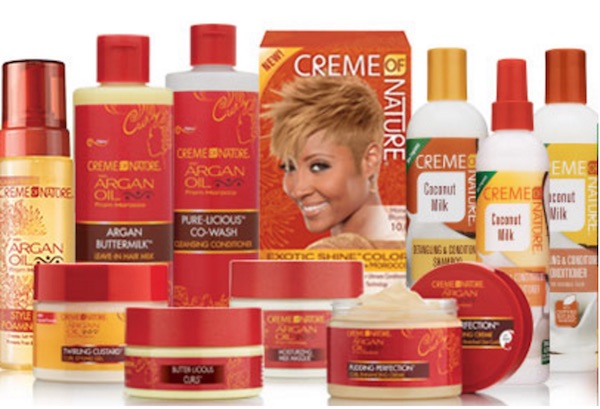
At what (x,y) coordinates should I click in order to perform the action: click on jar lids. Please return your answer as a coordinate pair (x, y). This screenshot has width=600, height=409. Looking at the image, I should click on (106, 289), (287, 280), (207, 328), (492, 295).